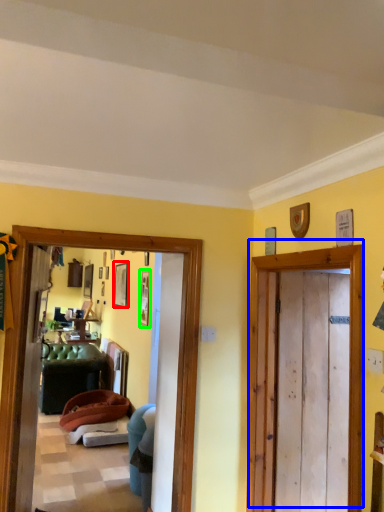
Question: Which is farther away from picture frame (highlighted by a red box)? door (highlighted by a blue box) or picture frame (highlighted by a green box)?

Choices:
 (A) door
 (B) picture frame

Answer: (A)